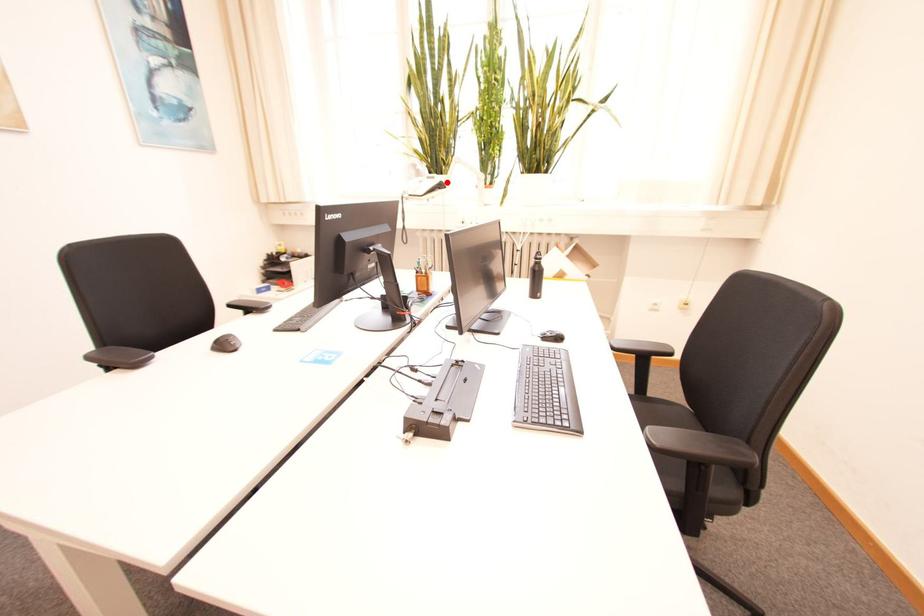
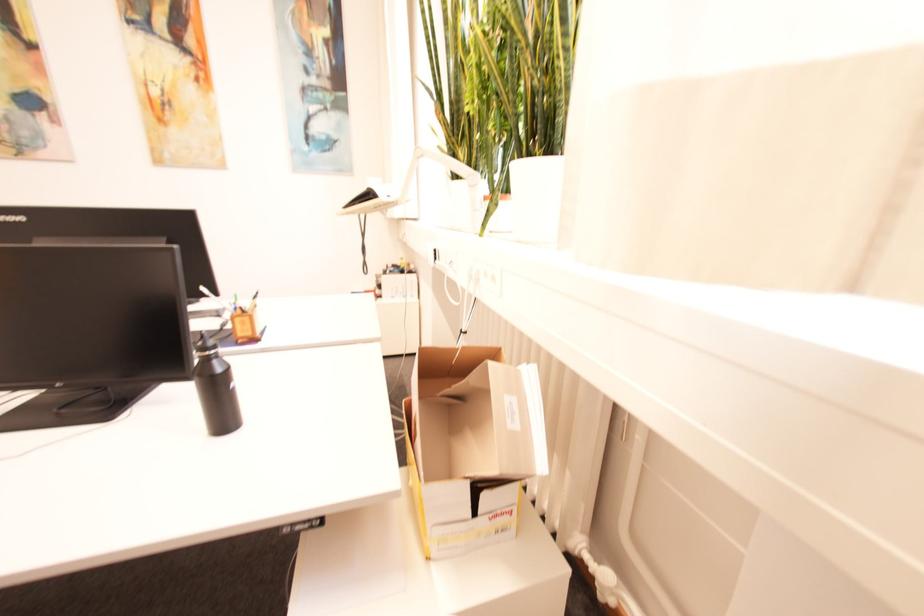
Where in the second image is the point corresponding to the highlighted location from the first image?

(375, 188)